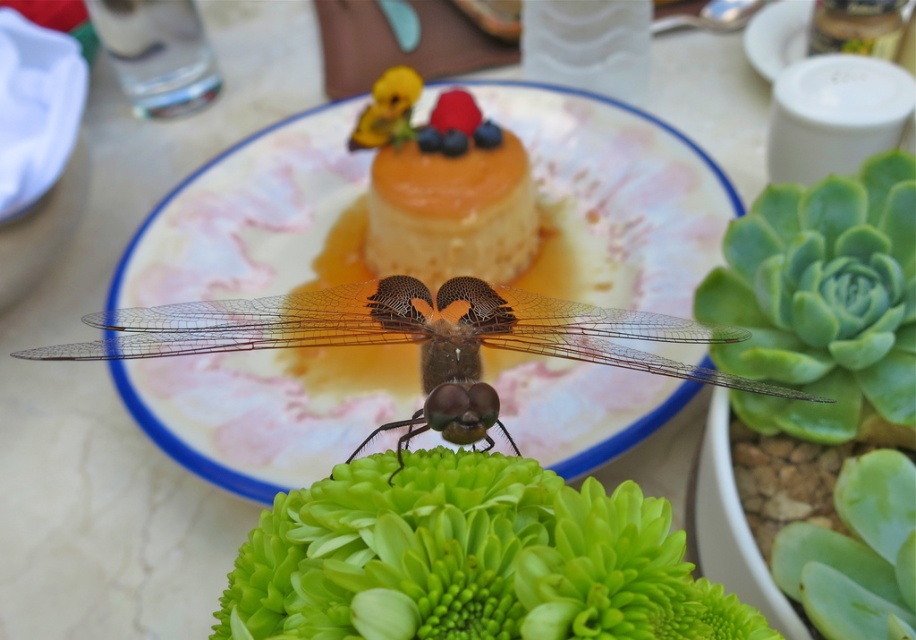
Question: Is the position of translucent glass plate at center more distant than that of translucent brown dragonfly at center?

Choices:
 (A) no
 (B) yes

Answer: (B)

Question: Is translucent brown dragonfly at center thinner than golden caramel flan at center?

Choices:
 (A) no
 (B) yes

Answer: (A)

Question: Among these points, which one is farthest from the camera?

Choices:
 (A) (620, 234)
 (B) (236, 577)
 (C) (319, 317)
 (D) (407, 148)

Answer: (A)

Question: Does green matte flower at center lie in front of golden caramel flan at center?

Choices:
 (A) yes
 (B) no

Answer: (A)

Question: Estimate the real-world distances between objects in this image. Which object is closer to the translucent glass plate at center?

Choices:
 (A) golden caramel flan at center
 (B) green matte flower at center
 (C) translucent brown dragonfly at center

Answer: (A)

Question: Which point is closer to the camera taking this photo?

Choices:
 (A) (127, 330)
 (B) (529, 234)
 (C) (462, 636)

Answer: (C)